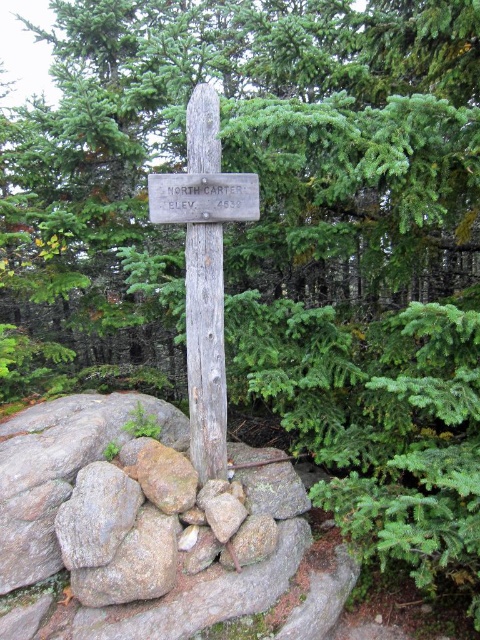
You are hiking and come across a wooden post with two objects attached. You need to determine their arrangement. Which object is on the left when facing the post? The options are the green rough wood sign at center and the weathered wood cross at center.

The green rough wood sign at center is positioned on the left side of the weathered wood cross at center, so when facing the post, the green rough wood sign at center is on the left.

Consider the image. You are hiking and come across a wooden post with two objects attached. You need to determine which one is taller between the green rough wood sign at center and the weathered wood cross at center. Which one is taller?

The green rough wood sign at center is much taller than the weathered wood cross at center.